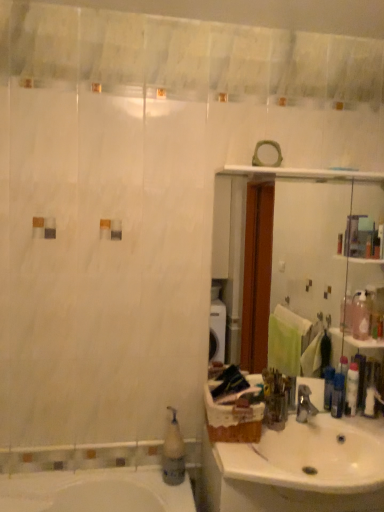
Question: Is white plastic soap dispenser at lower left wider than white ceramic sink at lower right?

Choices:
 (A) yes
 (B) no

Answer: (B)

Question: Is white plastic soap dispenser at lower left looking in the opposite direction of white ceramic sink at lower right?

Choices:
 (A) no
 (B) yes

Answer: (A)

Question: Is white ceramic sink at lower right located within white plastic soap dispenser at lower left?

Choices:
 (A) yes
 (B) no

Answer: (B)

Question: Would you say white plastic soap dispenser at lower left is a long distance from white ceramic sink at lower right?

Choices:
 (A) no
 (B) yes

Answer: (A)

Question: From a real-world perspective, is white plastic soap dispenser at lower left beneath white ceramic sink at lower right?

Choices:
 (A) no
 (B) yes

Answer: (A)

Question: In terms of height, does silver metallic faucet at sink right look taller or shorter compared to blue plastic bottle at sink?

Choices:
 (A) tall
 (B) short

Answer: (B)

Question: From the image's perspective, is silver metallic faucet at sink right above or below blue plastic bottle at sink?

Choices:
 (A) above
 (B) below

Answer: (B)

Question: Looking at their shapes, would you say silver metallic faucet at sink right is wider or thinner than blue plastic bottle at sink?

Choices:
 (A) wide
 (B) thin

Answer: (A)

Question: Considering the positions of point (301, 406) and point (332, 407), is point (301, 406) closer or farther from the camera than point (332, 407)?

Choices:
 (A) farther
 (B) closer

Answer: (B)

Question: Relative to blue plastic bottle at sink, is white plastic soap dispenser at lower left in front or behind?

Choices:
 (A) behind
 (B) front

Answer: (B)

Question: From a real-world perspective, is white plastic soap dispenser at lower left positioned above or below blue plastic bottle at sink?

Choices:
 (A) below
 (B) above

Answer: (A)

Question: Considering the positions of white plastic soap dispenser at lower left and blue plastic bottle at sink in the image, is white plastic soap dispenser at lower left bigger or smaller than blue plastic bottle at sink?

Choices:
 (A) big
 (B) small

Answer: (A)

Question: Do you think white plastic soap dispenser at lower left is within blue plastic bottle at sink, or outside of it?

Choices:
 (A) inside
 (B) outside

Answer: (B)

Question: Would you say white plastic soap dispenser at lower left is to the left or to the right of silver metallic faucet at sink right in the picture?

Choices:
 (A) right
 (B) left

Answer: (B)

Question: Considering the positions of white plastic soap dispenser at lower left and silver metallic faucet at sink right in the image, is white plastic soap dispenser at lower left wider or thinner than silver metallic faucet at sink right?

Choices:
 (A) thin
 (B) wide

Answer: (A)